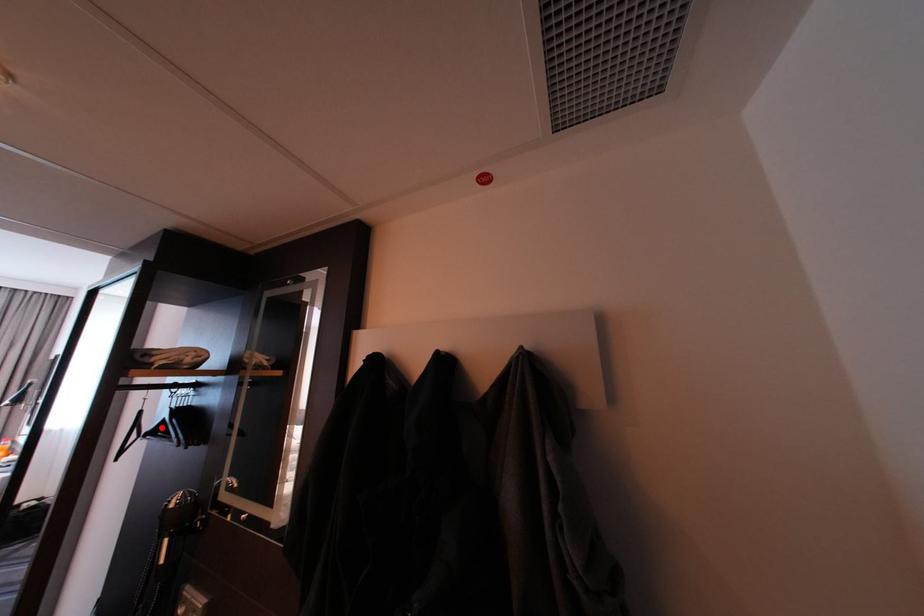
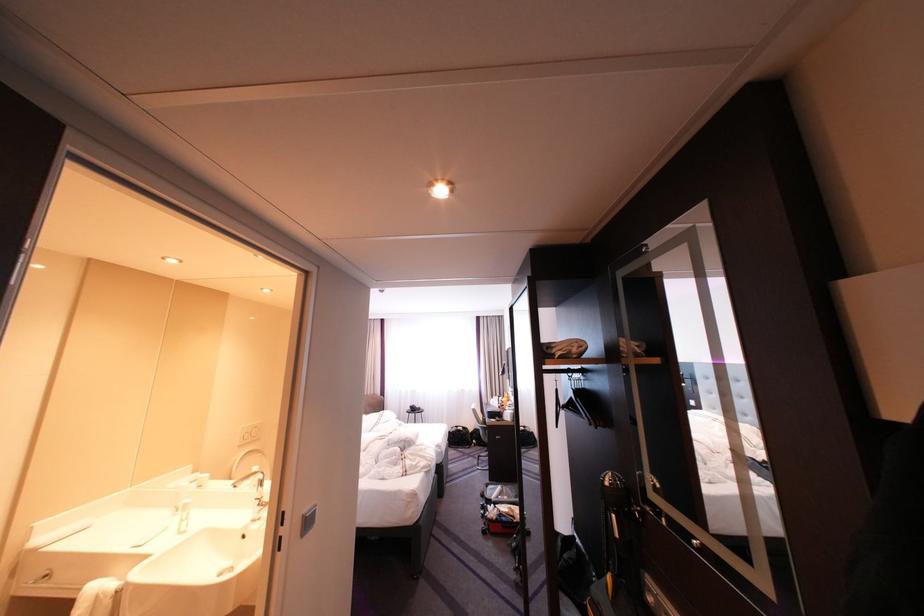
Locate, in the second image, the point that corresponds to the highlighted location in the first image.

(576, 402)